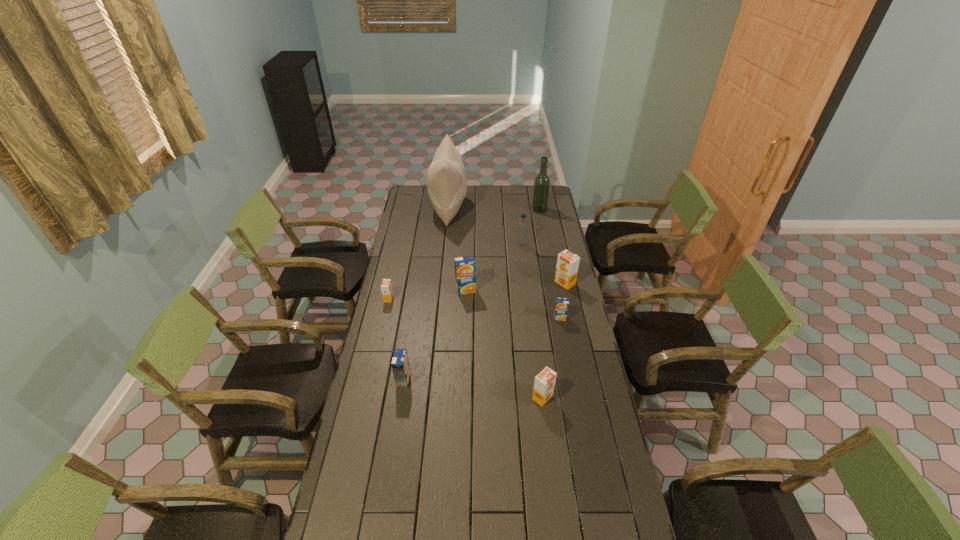
The height and width of the screenshot is (540, 960). Identify the location of the leftmost blue orange_juice. (400, 365).

The image size is (960, 540). Find the location of `the nearest blue orange_juice`. the nearest blue orange_juice is located at coordinates (400, 365).

Find the location of a particular element. The image size is (960, 540). the leftmost object is located at coordinates (386, 287).

Where is `the smallest orange orange juice`? Image resolution: width=960 pixels, height=540 pixels. the smallest orange orange juice is located at coordinates 386,287.

At what (x,y) coordinates should I click in order to perform the action: click on the third nearest orange_juice. Please return your answer as a coordinate pair (x, y). This screenshot has width=960, height=540. Looking at the image, I should click on (561, 308).

You are a GUI agent. You are given a task and a screenshot of the screen. Output one action in this format:
    pyautogui.click(x=<x>, y=<y>)
    Task: Click on the second farthest blue orange_juice
    Image resolution: width=960 pixels, height=540 pixels.
    Given the screenshot: What is the action you would take?
    pyautogui.click(x=561, y=308)

Find the location of `vacant space positioned on the front side of the cushion`. vacant space positioned on the front side of the cushion is located at coordinates (479, 208).

Locate an element on the screen. This screenshot has height=540, width=960. vacant space located 0.080m on the back of the liquor is located at coordinates [538, 199].

Find the location of a particular element. free space located on the back of the seventh nearest object is located at coordinates (518, 222).

Identify the location of vacant region located 0.080m on the front of the biggest blue orange_juice. (466, 307).